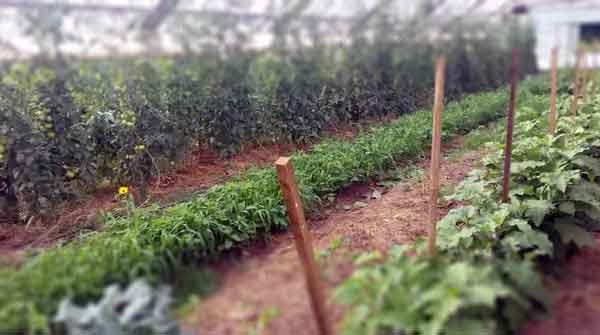
Identify the location of dark green plants. Image resolution: width=600 pixels, height=335 pixels. (298, 118), (378, 100), (408, 92), (241, 121), (68, 153).